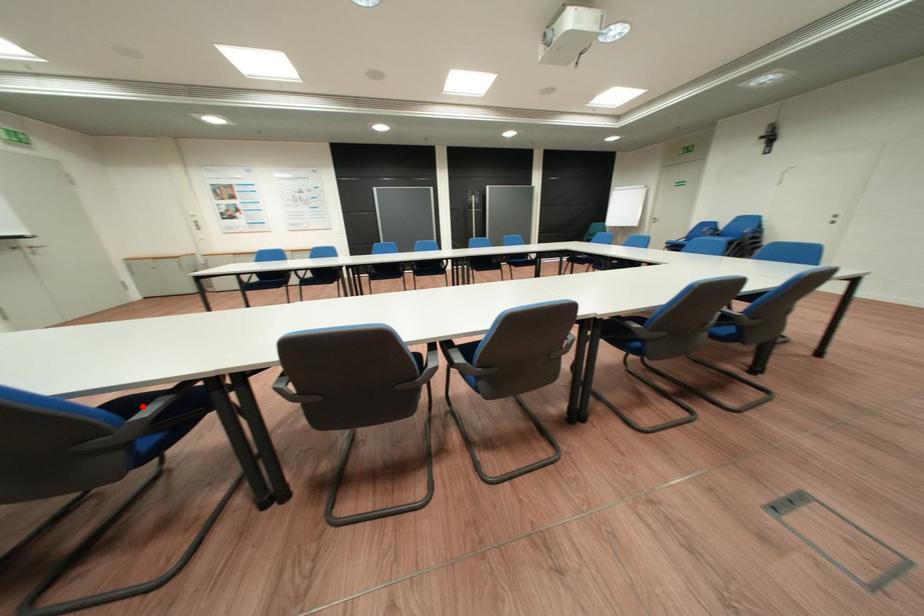
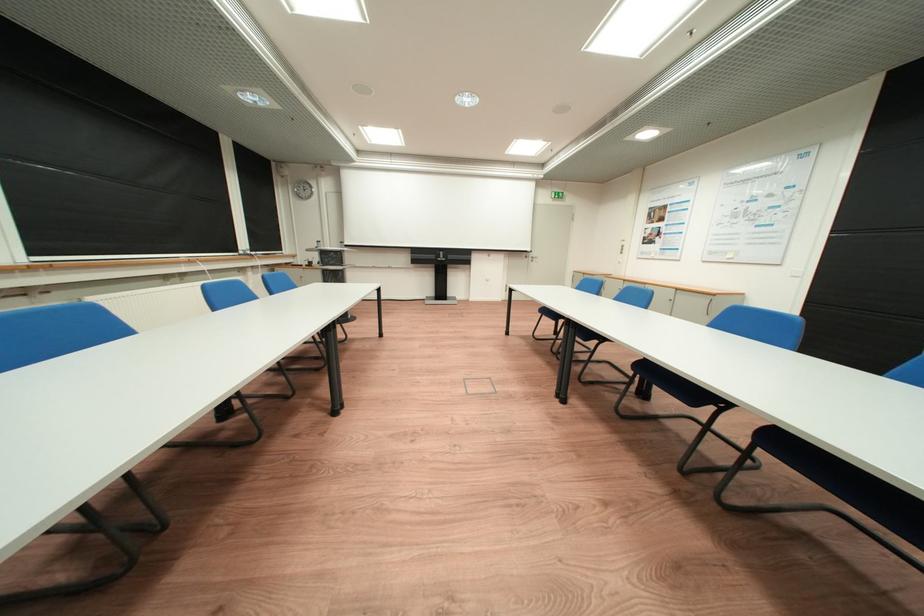
Question: I am providing you with two images of the same scene from different viewpoints. A red point is marked on the first image. Is the red point's position out of view in image 2?

Choices:
 (A) Yes
 (B) No

Answer: (A)